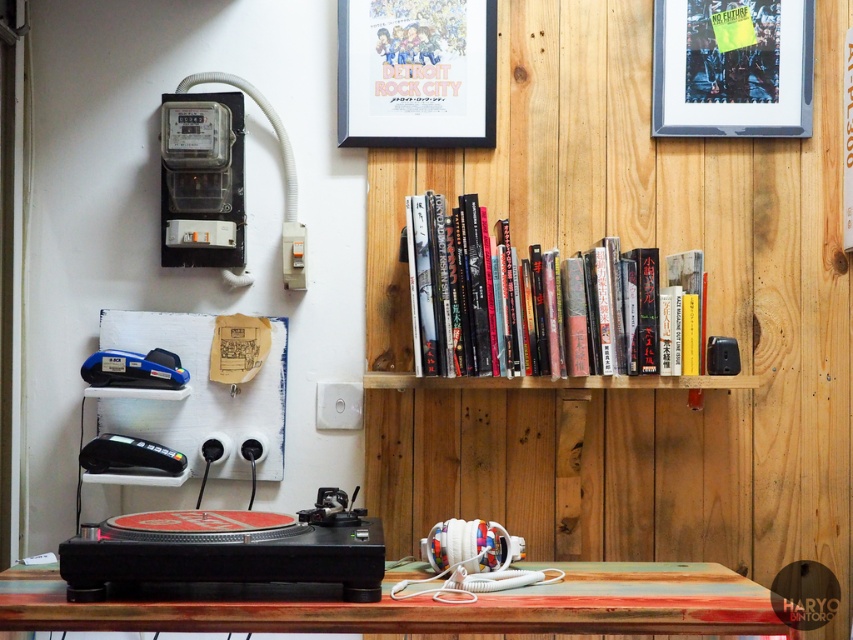
Who is higher up, matte paper poster at upper center or blue plastic stapler at left?

Positioned higher is matte paper poster at upper center.

Who is positioned more to the right, matte paper poster at upper center or blue plastic stapler at left?

matte paper poster at upper center

Does point (473, 24) come behind point (91, 376)?

Yes, point (473, 24) is behind point (91, 376).

At what (x,y) coordinates should I click in order to perform the action: click on matte paper poster at upper center. Please return your answer as a coordinate pair (x, y). This screenshot has height=640, width=853. Looking at the image, I should click on (416, 72).

Where is `wooden bookshelf at upper center`? wooden bookshelf at upper center is located at coordinates 660,257.

Can you confirm if wooden bookshelf at upper center is wider than rustic wood table at lower center?

Incorrect, wooden bookshelf at upper center's width does not surpass rustic wood table at lower center's.

Who is more forward, (718, 422) or (737, 592)?

Point (737, 592)

What are the coordinates of `wooden bookshelf at upper center` in the screenshot? It's located at (660, 257).

Can you confirm if matte paper poster at upper center is taller than black plastic credit card reader at lower left?

Yes, matte paper poster at upper center is taller than black plastic credit card reader at lower left.

Between matte paper poster at upper center and black plastic credit card reader at lower left, which one is positioned lower?

Positioned lower is black plastic credit card reader at lower left.

Measure the distance between matte paper poster at upper center and camera.

matte paper poster at upper center and camera are 6.85 feet apart from each other.

Locate an element on the screen. The width and height of the screenshot is (853, 640). matte paper poster at upper center is located at coordinates (416, 72).